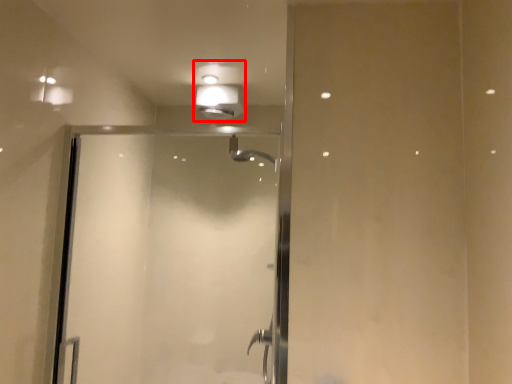
Question: In this image, where is light fixture (annotated by the red box) located relative to screen door?

Choices:
 (A) right
 (B) left

Answer: (A)